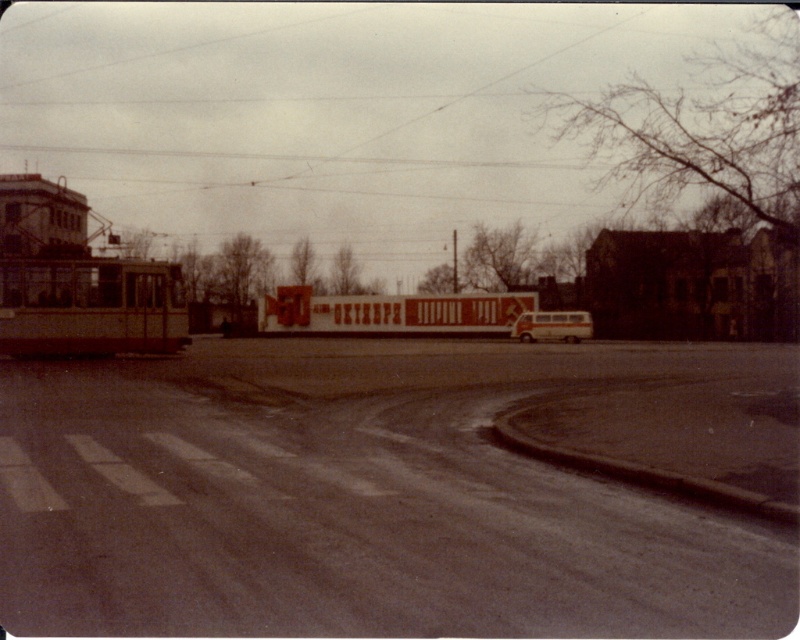
Question: Which of the following is the farthest from the observer?

Choices:
 (A) light beige metallic bus at center
 (B) metallic silver bus at left

Answer: (A)

Question: Can you confirm if metallic silver bus at left is positioned above light beige metallic bus at center?

Choices:
 (A) no
 (B) yes

Answer: (B)

Question: Which point appears farthest from the camera in this image?

Choices:
 (A) (554, 310)
 (B) (64, 314)

Answer: (A)

Question: Can you confirm if metallic silver bus at left is wider than light beige metallic bus at center?

Choices:
 (A) no
 (B) yes

Answer: (B)

Question: Which point is closer to the camera?

Choices:
 (A) light beige metallic bus at center
 (B) metallic silver bus at left

Answer: (B)

Question: Is metallic silver bus at left above light beige metallic bus at center?

Choices:
 (A) yes
 (B) no

Answer: (A)